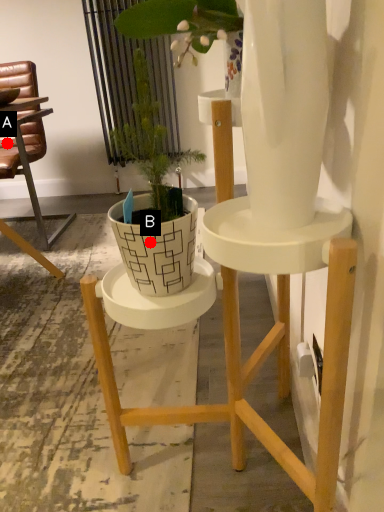
Question: Two points are circled on the image, labeled by A and B beside each circle. Which point is further to the camera?

Choices:
 (A) A is further
 (B) B is further

Answer: (A)